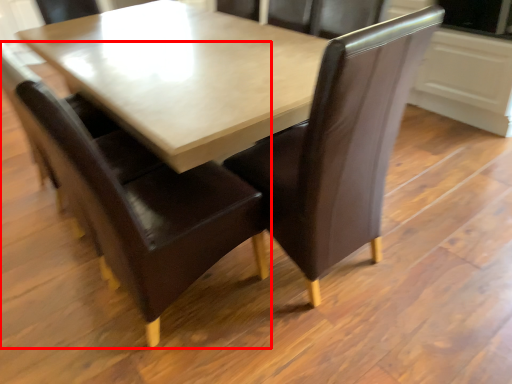
Question: From the image's perspective, where is chair (annotated by the red box) located relative to chair?

Choices:
 (A) below
 (B) above

Answer: (A)